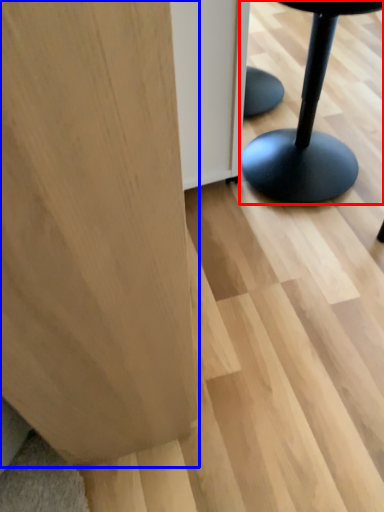
Question: Which point is closer to the camera, furniture (highlighted by a red box) or plywood (highlighted by a blue box)?

Choices:
 (A) furniture
 (B) plywood

Answer: (B)